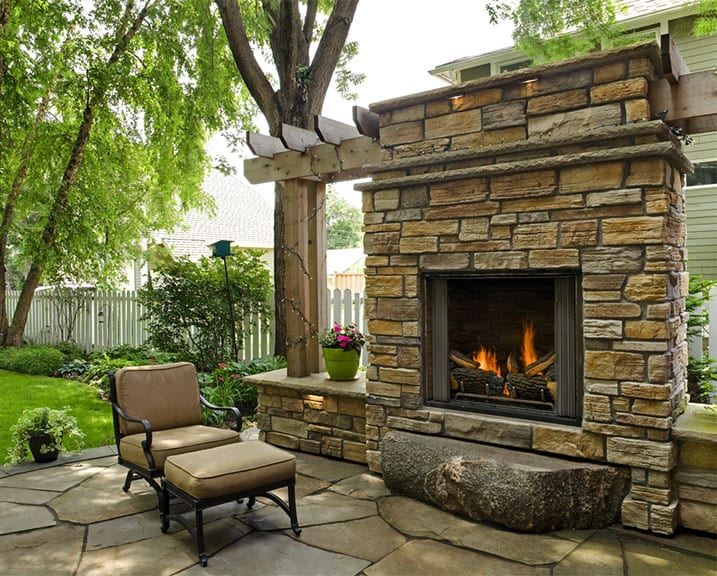
At what (x,y) coordinates should I click in order to perform the action: click on planters. Please return your answer as a coordinate pair (x, y). Looking at the image, I should click on (44, 449), (350, 362).